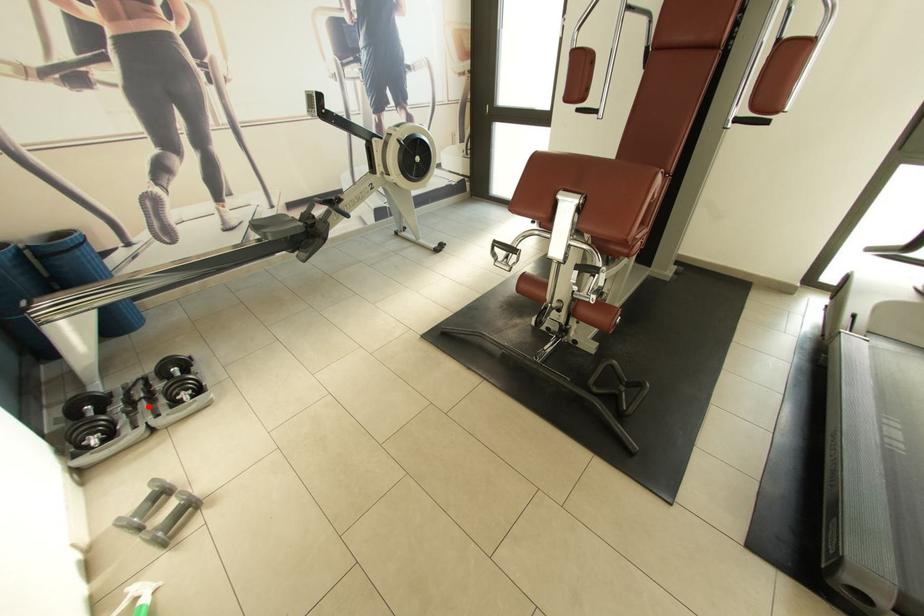
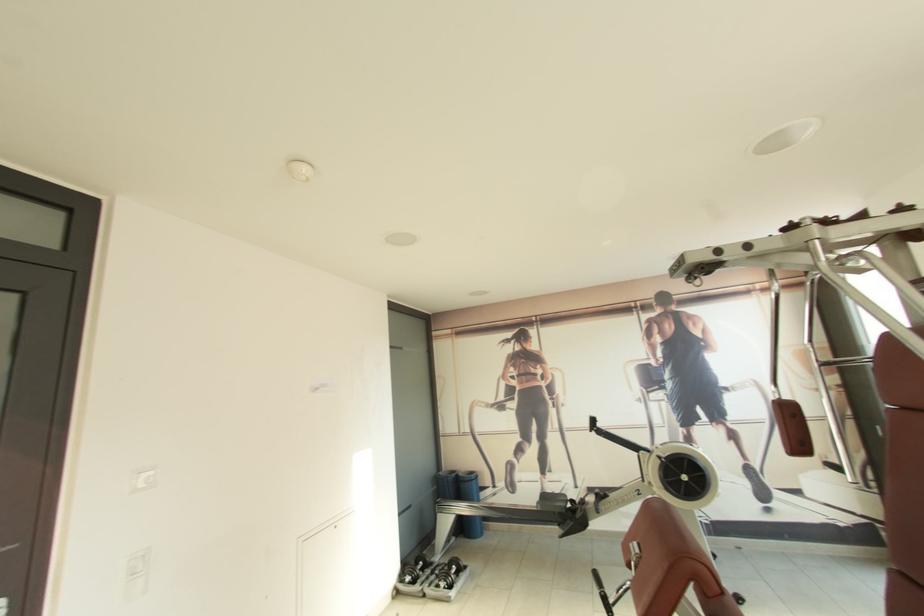
Find the pixel in the second image that matches the highlighted location in the first image.

(436, 578)